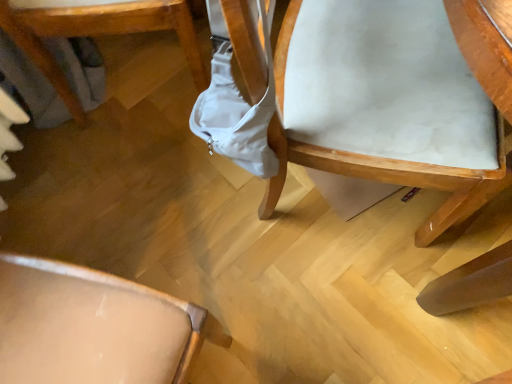
Measure the distance between point (x=37, y=1) and camera.

A distance of 31.93 inches exists between point (x=37, y=1) and camera.

Describe the element at coordinates (96, 33) in the screenshot. I see `light brown wood chair at lower left, which is the 2th chair from right to left` at that location.

At what (x,y) coordinates should I click in order to perform the action: click on light brown wood chair at lower left, which is the first chair in left-to-right order. Please return your answer as a coordinate pair (x, y). Image resolution: width=512 pixels, height=384 pixels. Looking at the image, I should click on (96, 33).

Identify the location of white fabric chair at upper right, the 1th chair in the right-to-left sequence. (395, 100).

Describe the element at coordinates (395, 100) in the screenshot. I see `white fabric chair at upper right, the 2th chair from the left` at that location.

Image resolution: width=512 pixels, height=384 pixels. In order to click on light brown wood chair at lower left, which is the first chair in left-to-right order in this screenshot , I will do `click(96, 33)`.

Is white fabric chair at upper right, the 1th chair in the right-to-left sequence, at the right side of light brown wood chair at lower left, which is the first chair in left-to-right order?

Yes.

Between white fabric chair at upper right, the 2th chair from the left, and light brown wood chair at lower left, which is the 2th chair from right to left, which one is positioned behind?

light brown wood chair at lower left, which is the 2th chair from right to left, is further from the camera.

Does point (451, 174) appear closer or farther from the camera than point (116, 25)?

Point (451, 174) appears to be closer to the viewer than point (116, 25).

From the image's perspective, relative to light brown wood chair at lower left, which is the first chair in left-to-right order, is white fabric chair at upper right, the 1th chair in the right-to-left sequence, above or below?

white fabric chair at upper right, the 1th chair in the right-to-left sequence, is below light brown wood chair at lower left, which is the first chair in left-to-right order.

From a real-world perspective, between white fabric chair at upper right, the 2th chair from the left, and light brown wood chair at lower left, which is the 2th chair from right to left, who is vertically higher?

white fabric chair at upper right, the 2th chair from the left, is physically above.

In terms of width, does white fabric chair at upper right, the 1th chair in the right-to-left sequence, look wider or thinner when compared to light brown wood chair at lower left, which is the 2th chair from right to left?

Considering their sizes, white fabric chair at upper right, the 1th chair in the right-to-left sequence, looks broader than light brown wood chair at lower left, which is the 2th chair from right to left.

Considering the sizes of objects white fabric chair at upper right, the 2th chair from the left, and light brown wood chair at lower left, which is the first chair in left-to-right order, in the image provided, who is taller, white fabric chair at upper right, the 2th chair from the left, or light brown wood chair at lower left, which is the first chair in left-to-right order,?

white fabric chair at upper right, the 2th chair from the left, is taller.

Who is smaller, white fabric chair at upper right, the 2th chair from the left, or light brown wood chair at lower left, which is the 2th chair from right to left?

light brown wood chair at lower left, which is the 2th chair from right to left.

Is white fabric chair at upper right, the 1th chair in the right-to-left sequence, outside of light brown wood chair at lower left, which is the first chair in left-to-right order?

Absolutely, white fabric chair at upper right, the 1th chair in the right-to-left sequence, is external to light brown wood chair at lower left, which is the first chair in left-to-right order.

Is there a large distance between white fabric chair at upper right, the 1th chair in the right-to-left sequence, and light brown wood chair at lower left, which is the 2th chair from right to left?

Actually, white fabric chair at upper right, the 1th chair in the right-to-left sequence, and light brown wood chair at lower left, which is the 2th chair from right to left, are a little close together.

Is white fabric chair at upper right, the 2th chair from the left, turned away from light brown wood chair at lower left, which is the first chair in left-to-right order?

Correct, white fabric chair at upper right, the 2th chair from the left, is looking away from light brown wood chair at lower left, which is the first chair in left-to-right order.

Looking at this image, how different are the orientations of white fabric chair at upper right, the 1th chair in the right-to-left sequence, and light brown wood chair at lower left, which is the 2th chair from right to left, in degrees?

14 degrees.

The image size is (512, 384). Identify the location of chair on the left of white fabric chair at upper right, the 1th chair in the right-to-left sequence. pyautogui.click(x=96, y=33).

Considering the relative positions of light brown wood chair at lower left, which is the 2th chair from right to left, and white fabric chair at upper right, the 2th chair from the left, in the image provided, is light brown wood chair at lower left, which is the 2th chair from right to left, to the left or to the right of white fabric chair at upper right, the 2th chair from the left,?

light brown wood chair at lower left, which is the 2th chair from right to left, is positioned on white fabric chair at upper right, the 2th chair from the left,'s left side.

Is light brown wood chair at lower left, which is the first chair in left-to-right order, in front of or behind white fabric chair at upper right, the 1th chair in the right-to-left sequence, in the image?

light brown wood chair at lower left, which is the first chair in left-to-right order, is positioned farther from the viewer than white fabric chair at upper right, the 1th chair in the right-to-left sequence.

Does point (119, 17) lie in front of point (342, 130)?

No, it is not.

From the image's perspective, which object appears higher, light brown wood chair at lower left, which is the first chair in left-to-right order, or white fabric chair at upper right, the 2th chair from the left?

From the image's view, light brown wood chair at lower left, which is the first chair in left-to-right order, is above.

From a real-world perspective, is light brown wood chair at lower left, which is the 2th chair from right to left, over white fabric chair at upper right, the 1th chair in the right-to-left sequence?

No, from a real-world perspective, light brown wood chair at lower left, which is the 2th chair from right to left, is not above white fabric chair at upper right, the 1th chair in the right-to-left sequence.

Can you confirm if light brown wood chair at lower left, which is the first chair in left-to-right order, is thinner than white fabric chair at upper right, the 1th chair in the right-to-left sequence?

Indeed, light brown wood chair at lower left, which is the first chair in left-to-right order, has a lesser width compared to white fabric chair at upper right, the 1th chair in the right-to-left sequence.

Considering the sizes of light brown wood chair at lower left, which is the first chair in left-to-right order, and white fabric chair at upper right, the 2th chair from the left, in the image, is light brown wood chair at lower left, which is the first chair in left-to-right order, taller or shorter than white fabric chair at upper right, the 2th chair from the left,?

In the image, light brown wood chair at lower left, which is the first chair in left-to-right order, appears to be shorter than white fabric chair at upper right, the 2th chair from the left.

From the picture: Looking at the image, does light brown wood chair at lower left, which is the 2th chair from right to left, seem bigger or smaller compared to white fabric chair at upper right, the 1th chair in the right-to-left sequence?

light brown wood chair at lower left, which is the 2th chair from right to left, is smaller than white fabric chair at upper right, the 1th chair in the right-to-left sequence.

Is light brown wood chair at lower left, which is the 2th chair from right to left, situated inside white fabric chair at upper right, the 2th chair from the left, or outside?

light brown wood chair at lower left, which is the 2th chair from right to left, cannot be found inside white fabric chair at upper right, the 2th chair from the left.

Is light brown wood chair at lower left, which is the first chair in left-to-right order, with white fabric chair at upper right, the 2th chair from the left?

No.

Is light brown wood chair at lower left, which is the first chair in left-to-right order, positioned with its back to white fabric chair at upper right, the 1th chair in the right-to-left sequence?

No, light brown wood chair at lower left, which is the first chair in left-to-right order,'s orientation is not away from white fabric chair at upper right, the 1th chair in the right-to-left sequence.

In the scene shown: How many degrees apart are the facing directions of light brown wood chair at lower left, which is the 2th chair from right to left, and white fabric chair at upper right, the 1th chair in the right-to-left sequence?

14 degrees separate the facing orientations of light brown wood chair at lower left, which is the 2th chair from right to left, and white fabric chair at upper right, the 1th chair in the right-to-left sequence.

How much distance is there between light brown wood chair at lower left, which is the 2th chair from right to left, and white fabric chair at upper right, the 1th chair in the right-to-left sequence?

light brown wood chair at lower left, which is the 2th chair from right to left, and white fabric chair at upper right, the 1th chair in the right-to-left sequence, are 18.00 inches apart from each other.

Where is `chair on the left of white fabric chair at upper right, the 1th chair in the right-to-left sequence`? The width and height of the screenshot is (512, 384). chair on the left of white fabric chair at upper right, the 1th chair in the right-to-left sequence is located at coordinates (96, 33).

The image size is (512, 384). In order to click on chair behind the white fabric chair at upper right, the 2th chair from the left in this screenshot , I will do `click(96, 33)`.

The height and width of the screenshot is (384, 512). I want to click on chair below the light brown wood chair at lower left, which is the 2th chair from right to left (from the image's perspective), so point(395,100).